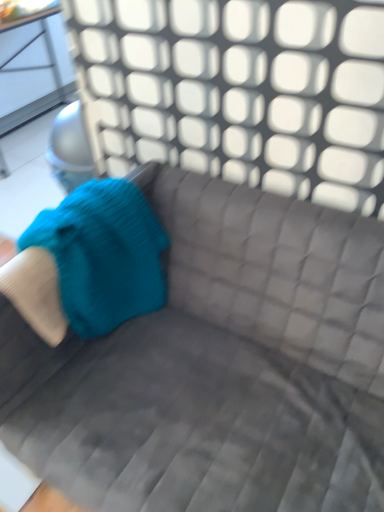
You are a GUI agent. You are given a task and a screenshot of the screen. Output one action in this format:
    pyautogui.click(x=<x>, y=<y>)
    Task: Click on the empty space that is ontop of teal knitted bean bag chair at left (from a real-world perspective)
    This screenshot has width=384, height=512.
    Given the screenshot: What is the action you would take?
    pyautogui.click(x=52, y=238)